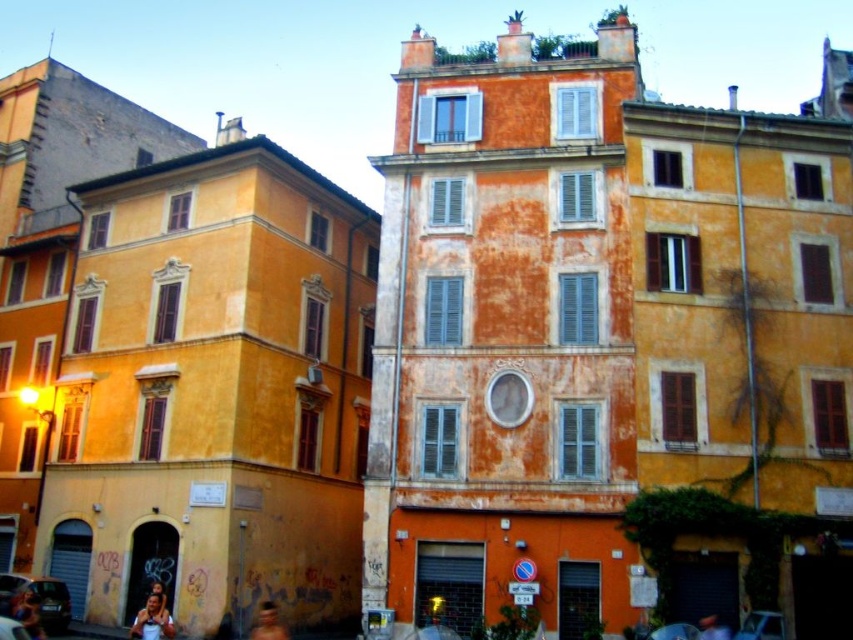
Question: Among these points, which one is farthest from the camera?

Choices:
 (A) (270, 632)
 (B) (151, 604)

Answer: (A)

Question: Can you confirm if smooth skin face at lower left is wider than blurred skin at lower center?

Choices:
 (A) yes
 (B) no

Answer: (B)

Question: Which point appears farthest from the camera in this image?

Choices:
 (A) (157, 604)
 (B) (30, 636)

Answer: (A)

Question: Is blue denim jeans at lower left thinner than blurred skin at lower center?

Choices:
 (A) no
 (B) yes

Answer: (A)

Question: Is smooth skin face at lower left smaller than blurred skin at lower center?

Choices:
 (A) yes
 (B) no

Answer: (A)

Question: Which of the following is the farthest from the observer?

Choices:
 (A) blurred skin at lower center
 (B) smooth skin face at lower left

Answer: (A)